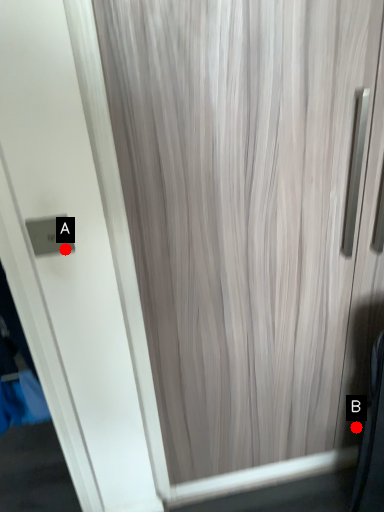
Question: Two points are circled on the image, labeled by A and B beside each circle. Which point is closer to the camera taking this photo?

Choices:
 (A) A is closer
 (B) B is closer

Answer: (A)